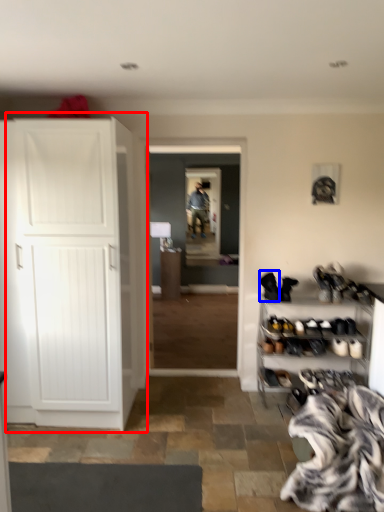
Question: Among these objects, which one is farthest to the camera, cupboard (highlighted by a red box) or footwear (highlighted by a blue box)?

Choices:
 (A) cupboard
 (B) footwear

Answer: (B)